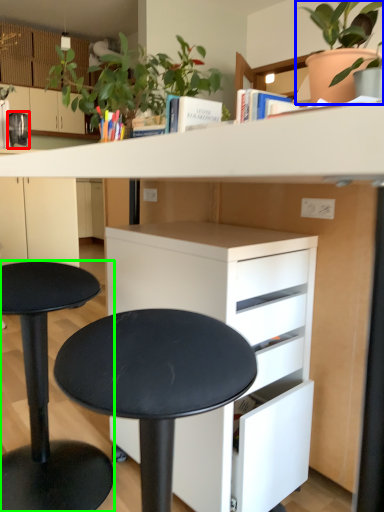
Question: Considering the real-world distances, which object is closest to appliance (highlighted by a red box)? houseplant (highlighted by a blue box) or stool (highlighted by a green box).

Choices:
 (A) houseplant
 (B) stool

Answer: (B)